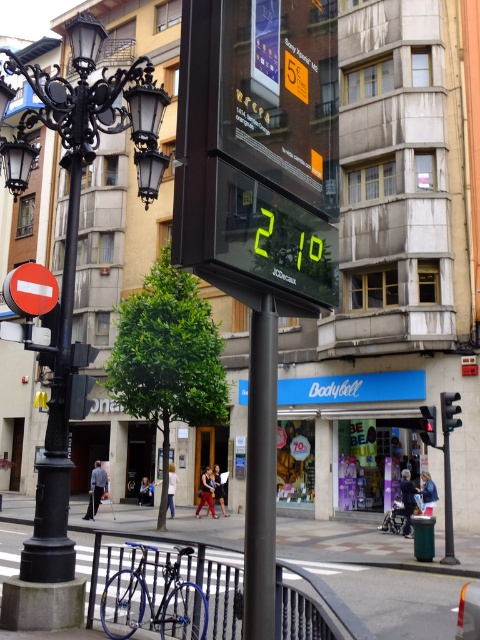
You are standing at the center of the urban street scene. You need to locate the black wrought iron streetlight at left. According to the coordinates provided, where exactly is it positioned?

The black wrought iron streetlight at left is positioned at coordinates point (72, 292).

You are standing at the point marked by the coordinates point [375,580] in the image. What type of surface are you currently standing on?

The surface at point [375,580] is smooth concrete pavement.